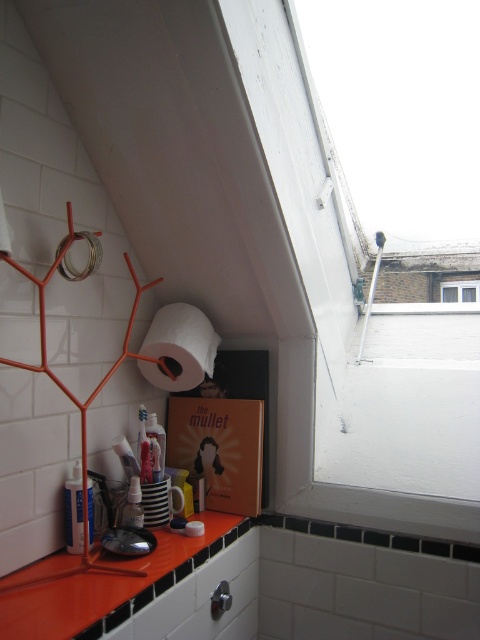
Question: Does orange glossy countertop at lower center appear on the left side of white matte toilet paper at center?

Choices:
 (A) no
 (B) yes

Answer: (B)

Question: Does translucent plastic tube at lower left appear on the right side of transparent glass window at upper right?

Choices:
 (A) yes
 (B) no

Answer: (B)

Question: Which of these objects is positioned closest to the white matte toilet paper at center?

Choices:
 (A) orange glossy countertop at lower center
 (B) translucent plastic tube at lower left

Answer: (B)

Question: Which object appears closest to the camera in this image?

Choices:
 (A) orange glossy countertop at lower center
 (B) white matte toilet paper at center
 (C) translucent plastic bottle at lower left
 (D) translucent plastic tube at lower left

Answer: (A)

Question: Which object is farther from the camera taking this photo?

Choices:
 (A) translucent plastic bottle at lower left
 (B) transparent glass window at upper right
 (C) white matte toilet paper at center

Answer: (B)

Question: Does translucent plastic tube at lower left have a larger size compared to transparent glass window at upper right?

Choices:
 (A) no
 (B) yes

Answer: (B)